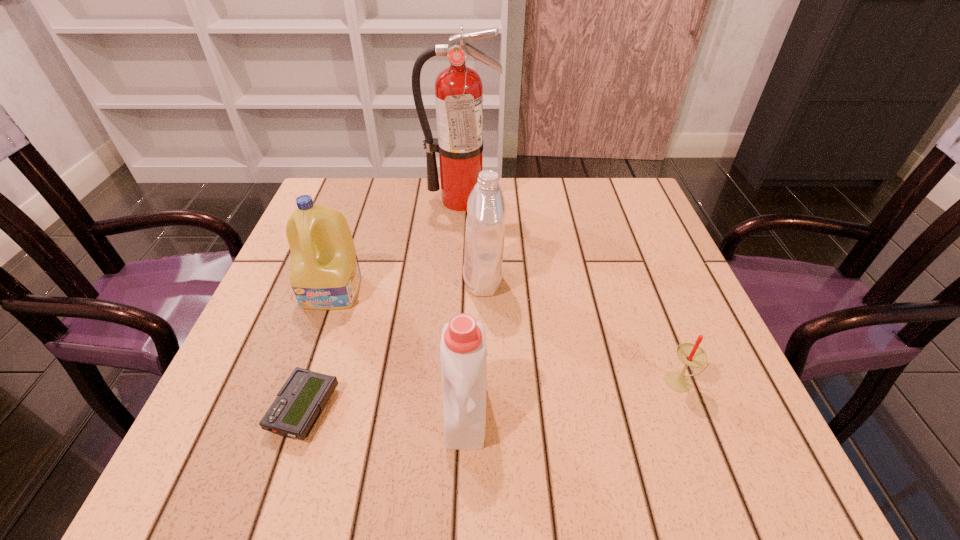
Image resolution: width=960 pixels, height=540 pixels. In order to click on fire extinguisher in this screenshot , I will do `click(458, 89)`.

Where is `the farthest object`? the farthest object is located at coordinates (458, 89).

The height and width of the screenshot is (540, 960). Identify the location of the leftmost detergent. (324, 271).

Identify the location of the nearest detergent. (463, 354).

You are a GUI agent. You are given a task and a screenshot of the screen. Output one action in this format:
    pyautogui.click(x=<x>, y=<y>)
    Task: Click on the fifth tallest object
    
    Given the screenshot: What is the action you would take?
    pyautogui.click(x=690, y=354)

I want to click on candle, so click(690, 354).

At what (x,y) coordinates should I click in order to perform the action: click on beeper. Please return your answer as a coordinate pair (x, y). This screenshot has width=960, height=540. Looking at the image, I should click on pos(298,405).

At what (x,y) coordinates should I click in order to perform the action: click on free space located 0.130m on the nozzle side of the farthest object. Please return your answer as a coordinate pair (x, y). The height and width of the screenshot is (540, 960). Looking at the image, I should click on (458, 244).

Find the location of a particular element. The image size is (960, 540). vacant space situated 0.300m on the label of the leftmost detergent is located at coordinates (276, 458).

The image size is (960, 540). What are the coordinates of `vacant space located 0.350m on the back of the rightmost object` in the screenshot? It's located at (629, 246).